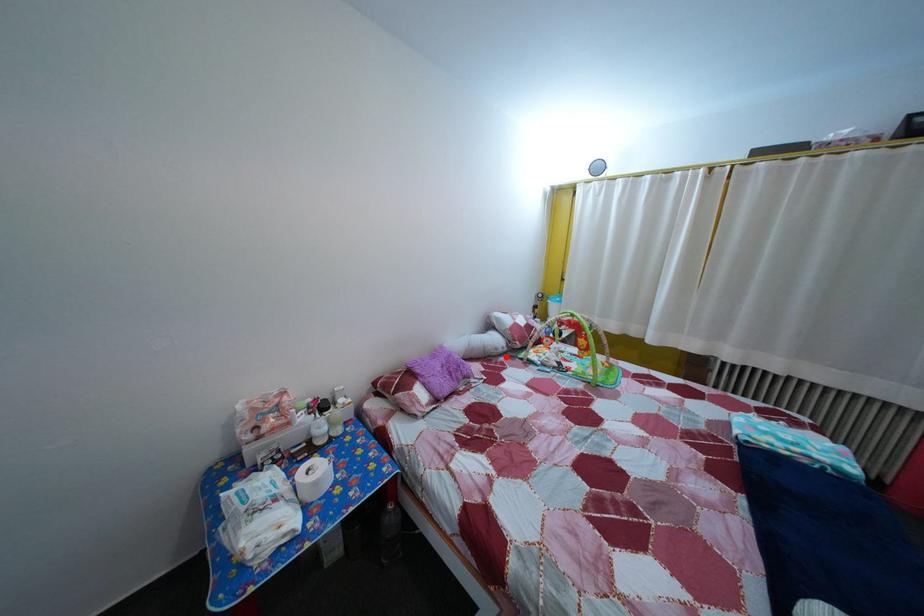
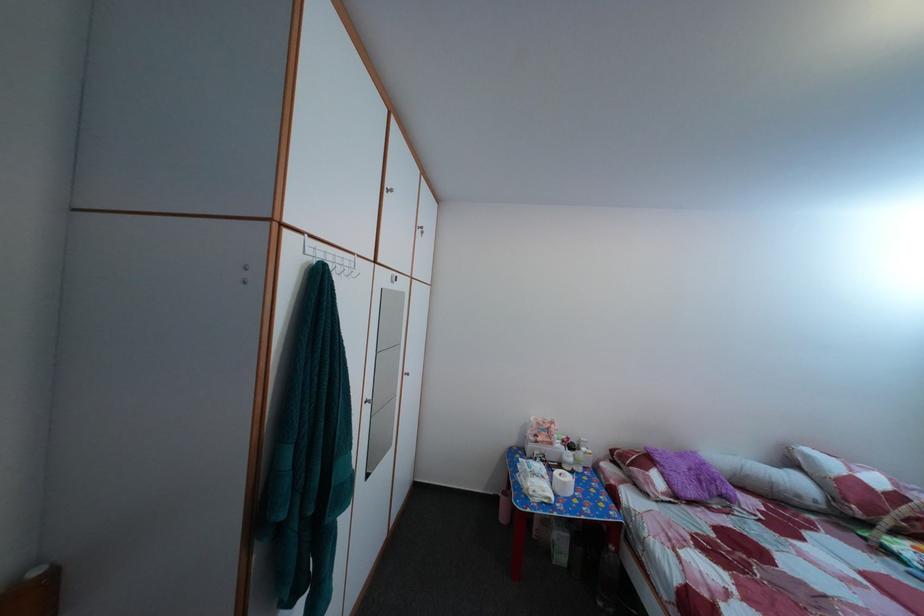
Question: I am providing you with two images of the same scene from different viewpoints. In image1, a red point is highlighted. Considering the same 3D point in image2, which of the following is correct?

Choices:
 (A) It is closer
 (B) It is farther

Answer: (A)